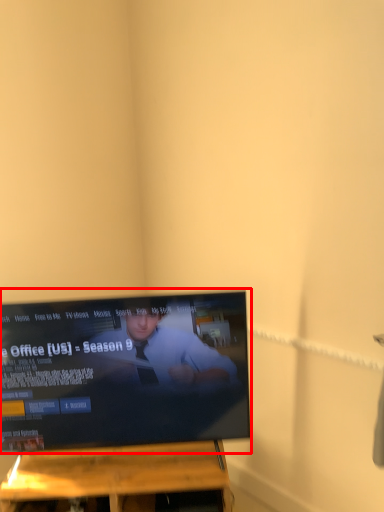
Question: From the image's perspective, where is television (annotated by the red box) located in relation to furniture in the image?

Choices:
 (A) above
 (B) below

Answer: (A)